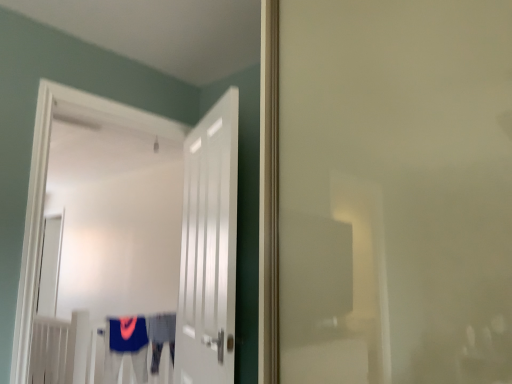
Describe the element at coordinates (126, 347) in the screenshot. This screenshot has width=512, height=384. I see `blue fabric robe at lower center, which appears as the 1th robe when viewed from the left` at that location.

What do you see at coordinates (128, 234) in the screenshot? I see `white glossy door at center, acting as the first door starting from the left` at bounding box center [128, 234].

Locate an element on the screen. Image resolution: width=512 pixels, height=384 pixels. blue fabric robe at center, which ranks as the 2th robe in left-to-right order is located at coordinates (161, 337).

What is the approximate width of white glossy door at center, which is the 2th door in left-to-right order?

It is 3.61 inches.

The width and height of the screenshot is (512, 384). Identify the location of blue fabric robe at lower center, the 2th robe in the right-to-left sequence. (126, 347).

Are blue fabric robe at center, which ranks as the 2th robe in left-to-right order, and white glossy door at center, the 2th door from the right, making contact?

No, blue fabric robe at center, which ranks as the 2th robe in left-to-right order, is not touching white glossy door at center, the 2th door from the right.

How far apart are blue fabric robe at center, the first robe from the right, and white glossy door at center, the 2th door from the right?

A distance of 4.32 feet exists between blue fabric robe at center, the first robe from the right, and white glossy door at center, the 2th door from the right.

From the image's perspective, is blue fabric robe at center, which ranks as the 2th robe in left-to-right order, above or below white glossy door at center, the 2th door from the right?

Clearly, from the image's perspective, blue fabric robe at center, which ranks as the 2th robe in left-to-right order, is below white glossy door at center, the 2th door from the right.

At what (x,y) coordinates should I click in order to perform the action: click on robe that is the 2nd object located behind the white glossy door at center, the 2th door from the right. Please return your answer as a coordinate pair (x, y). The image size is (512, 384). Looking at the image, I should click on (161, 337).

From the picture: Is white glossy door at center, which is the 2th door in left-to-right order, taller than blue fabric robe at center, the first robe from the right?

Yes, white glossy door at center, which is the 2th door in left-to-right order, is taller than blue fabric robe at center, the first robe from the right.

Looking at the image, does white glossy door at center, which is the 2th door in left-to-right order, seem bigger or smaller compared to blue fabric robe at center, which ranks as the 2th robe in left-to-right order?

In the image, white glossy door at center, which is the 2th door in left-to-right order, appears to be larger than blue fabric robe at center, which ranks as the 2th robe in left-to-right order.

From a real-world perspective, count 2nd robes downward from the white glossy door at center, which is the 2th door in left-to-right order, and point to it. Please provide its 2D coordinates.

[(161, 337)]

Between white glossy door at center, which is the 2th door in left-to-right order, and blue fabric robe at center, which ranks as the 2th robe in left-to-right order, which one has smaller width?

Thinner between the two is white glossy door at center, which is the 2th door in left-to-right order.

Which of these two, blue fabric robe at lower center, which appears as the 1th robe when viewed from the left, or white glossy door at center, which is the 2th door in left-to-right order, stands taller?

white glossy door at center, which is the 2th door in left-to-right order.

Which is behind, point (123, 349) or point (186, 180)?

The point (123, 349) is behind.

Based on the photo, is blue fabric robe at lower center, the 2th robe in the right-to-left sequence, completely or partially outside of white glossy door at center, the first door viewed from the right?

blue fabric robe at lower center, the 2th robe in the right-to-left sequence, lies outside white glossy door at center, the first door viewed from the right,'s area.

From the picture: Between blue fabric robe at lower center, the 2th robe in the right-to-left sequence, and white glossy door at center, which is the 2th door in left-to-right order, which one is positioned behind?

blue fabric robe at lower center, the 2th robe in the right-to-left sequence, is further away from the camera.

Would you say blue fabric robe at lower center, the 2th robe in the right-to-left sequence, contains white glossy door at center, acting as the first door starting from the left?

That's incorrect, white glossy door at center, acting as the first door starting from the left, is not inside blue fabric robe at lower center, the 2th robe in the right-to-left sequence.

Which object is wider, blue fabric robe at lower center, the 2th robe in the right-to-left sequence, or white glossy door at center, acting as the first door starting from the left?

white glossy door at center, acting as the first door starting from the left.

Is blue fabric robe at lower center, which appears as the 1th robe when viewed from the left, oriented away from white glossy door at center, the 2th door from the right?

blue fabric robe at lower center, which appears as the 1th robe when viewed from the left, is not turned away from white glossy door at center, the 2th door from the right.

From the picture: Is blue fabric robe at center, the first robe from the right, positioned behind blue fabric robe at lower center, the 2th robe in the right-to-left sequence?

Yes.

I want to click on robe that is under the blue fabric robe at lower center, which appears as the 1th robe when viewed from the left (from a real-world perspective), so click(161, 337).

Considering the relative sizes of blue fabric robe at center, the first robe from the right, and blue fabric robe at lower center, the 2th robe in the right-to-left sequence, in the image provided, is blue fabric robe at center, the first robe from the right, shorter than blue fabric robe at lower center, the 2th robe in the right-to-left sequence,?

No.

Is blue fabric robe at center, which ranks as the 2th robe in left-to-right order, not close to blue fabric robe at lower center, which appears as the 1th robe when viewed from the left?

No, there isn't a large distance between blue fabric robe at center, which ranks as the 2th robe in left-to-right order, and blue fabric robe at lower center, which appears as the 1th robe when viewed from the left.

Is white glossy door at center, the first door viewed from the right, facing away from white glossy door at center, the 2th door from the right?

white glossy door at center, the first door viewed from the right, does not have its back to white glossy door at center, the 2th door from the right.

Can you confirm if white glossy door at center, the first door viewed from the right, is smaller than white glossy door at center, the 2th door from the right?

Yes, white glossy door at center, the first door viewed from the right, is smaller than white glossy door at center, the 2th door from the right.

Does point (227, 233) come in front of point (143, 165)?

That is True.

Is there a large distance between white glossy door at center, the 2th door from the right, and white glossy door at center, which is the 2th door in left-to-right order?

Absolutely, white glossy door at center, the 2th door from the right, is distant from white glossy door at center, which is the 2th door in left-to-right order.

Can you confirm if white glossy door at center, acting as the first door starting from the left, is taller than white glossy door at center, which is the 2th door in left-to-right order?

Yes, white glossy door at center, acting as the first door starting from the left, is taller than white glossy door at center, which is the 2th door in left-to-right order.

Could you measure the distance between white glossy door at center, acting as the first door starting from the left, and white glossy door at center, the first door viewed from the right?

Result: white glossy door at center, acting as the first door starting from the left, is 2.12 meters from white glossy door at center, the first door viewed from the right.

Which object is positioned more to the right, white glossy door at center, acting as the first door starting from the left, or white glossy door at center, the first door viewed from the right?

From the viewer's perspective, white glossy door at center, the first door viewed from the right, appears more on the right side.

Find the location of a particular element. This screenshot has height=384, width=512. robe that is the 2nd object directly below the white glossy door at center, the 2th door from the right (from a real-world perspective) is located at coordinates (161, 337).

What are the coordinates of `the 2nd door in front of the blue fabric robe at center, which ranks as the 2th robe in left-to-right order` in the screenshot? It's located at (209, 248).

Considering their positions, is blue fabric robe at lower center, which appears as the 1th robe when viewed from the left, positioned closer to white glossy door at center, the 2th door from the right, than white glossy door at center, which is the 2th door in left-to-right order?

Among the two, blue fabric robe at lower center, which appears as the 1th robe when viewed from the left, is located nearer to white glossy door at center, the 2th door from the right.

From the picture: Based on their spatial positions, is blue fabric robe at center, the first robe from the right, or white glossy door at center, the 2th door from the right, further from blue fabric robe at lower center, which appears as the 1th robe when viewed from the left?

white glossy door at center, the 2th door from the right, is positioned further to the anchor blue fabric robe at lower center, which appears as the 1th robe when viewed from the left.

Considering their positions, is white glossy door at center, the 2th door from the right, positioned further to white glossy door at center, which is the 2th door in left-to-right order, than blue fabric robe at center, the first robe from the right?

white glossy door at center, the 2th door from the right, is further to white glossy door at center, which is the 2th door in left-to-right order.

Consider the image. Which object lies nearer to the anchor point blue fabric robe at lower center, the 2th robe in the right-to-left sequence, white glossy door at center, the first door viewed from the right, or blue fabric robe at center, which ranks as the 2th robe in left-to-right order?

blue fabric robe at center, which ranks as the 2th robe in left-to-right order, is positioned closer to the anchor blue fabric robe at lower center, the 2th robe in the right-to-left sequence.

Based on their spatial positions, is blue fabric robe at lower center, the 2th robe in the right-to-left sequence, or blue fabric robe at center, which ranks as the 2th robe in left-to-right order, closer to white glossy door at center, acting as the first door starting from the left?

blue fabric robe at lower center, the 2th robe in the right-to-left sequence, is positioned closer to the anchor white glossy door at center, acting as the first door starting from the left.

When comparing their distances from white glossy door at center, the 2th door from the right, does blue fabric robe at center, which ranks as the 2th robe in left-to-right order, or white glossy door at center, which is the 2th door in left-to-right order, seem closer?

blue fabric robe at center, which ranks as the 2th robe in left-to-right order, lies closer to white glossy door at center, the 2th door from the right, than the other object.

Estimate the real-world distances between objects in this image. Which object is further from blue fabric robe at center, which ranks as the 2th robe in left-to-right order, white glossy door at center, acting as the first door starting from the left, or blue fabric robe at lower center, which appears as the 1th robe when viewed from the left?

white glossy door at center, acting as the first door starting from the left, is further to blue fabric robe at center, which ranks as the 2th robe in left-to-right order.

When comparing their distances from white glossy door at center, which is the 2th door in left-to-right order, does white glossy door at center, acting as the first door starting from the left, or blue fabric robe at lower center, which appears as the 1th robe when viewed from the left, seem closer?

Based on the image, blue fabric robe at lower center, which appears as the 1th robe when viewed from the left, appears to be nearer to white glossy door at center, which is the 2th door in left-to-right order.

Locate an element on the screen. The width and height of the screenshot is (512, 384). robe located between white glossy door at center, acting as the first door starting from the left, and blue fabric robe at center, the first robe from the right, in the depth direction is located at coordinates (126, 347).

Identify the location of door between white glossy door at center, which is the 2th door in left-to-right order, and blue fabric robe at center, which ranks as the 2th robe in left-to-right order, along the z-axis. (128, 234).

Where is `robe positioned between white glossy door at center, which is the 2th door in left-to-right order, and blue fabric robe at center, the first robe from the right, from near to far`? robe positioned between white glossy door at center, which is the 2th door in left-to-right order, and blue fabric robe at center, the first robe from the right, from near to far is located at coordinates (126, 347).

You are a GUI agent. You are given a task and a screenshot of the screen. Output one action in this format:
    pyautogui.click(x=<x>, y=<y>)
    Task: Click on the door between white glossy door at center, the first door viewed from the right, and blue fabric robe at lower center, which appears as the 1th robe when viewed from the left, from front to back
    
    Given the screenshot: What is the action you would take?
    pyautogui.click(x=128, y=234)